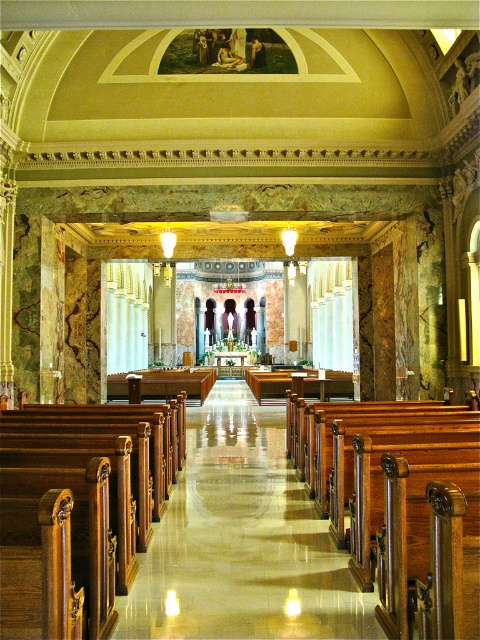
You are an event organizer planning to seat guests in the church. You have two options for seating arrangements using the polished wood pews at center and the polished wood church bench at center. Which seating option allows for more people to be seated if the space is limited?

The polished wood church bench at center is narrower than the polished wood pews at center, so using the bench would allow more people to be seated in the limited space.

You are standing at the entrance of the grand church and notice a point marked at coordinates (78, 512). According to the image, what object is located at this point?

The point at coordinates (78, 512) indicates the location of the polished wood pews at center.